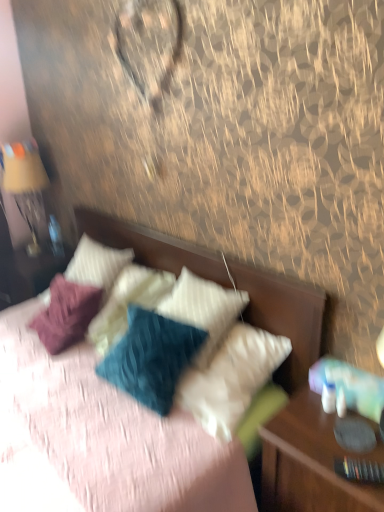
Question: Looking at their shapes, would you say white textured pillow at center, which ranks as the 2th pillow in right-to-left order, is wider or thinner than white textured pillow at upper center, the first pillow from the right?

Choices:
 (A) thin
 (B) wide

Answer: (B)

Question: From the image's perspective, is white textured pillow at center, marked as the 1th pillow in a left-to-right arrangement, above or below white textured pillow at upper center, placed as the 2th pillow when sorted from left to right?

Choices:
 (A) below
 (B) above

Answer: (B)

Question: Estimate the real-world distances between objects in this image. Which object is closer to the wooden nightstand at right?

Choices:
 (A) white textured pillow at upper center, placed as the 2th pillow when sorted from left to right
 (B) textured fabric bed at center
 (C) white textured pillow at center, marked as the 1th pillow in a left-to-right arrangement
 (D) matte gold lamp at left

Answer: (B)

Question: Based on their relative distances, which object is nearer to the textured fabric bed at center?

Choices:
 (A) matte gold lamp at left
 (B) white textured pillow at upper center, the first pillow from the right
 (C) wooden nightstand at right
 (D) white textured pillow at center, which ranks as the 2th pillow in right-to-left order

Answer: (B)